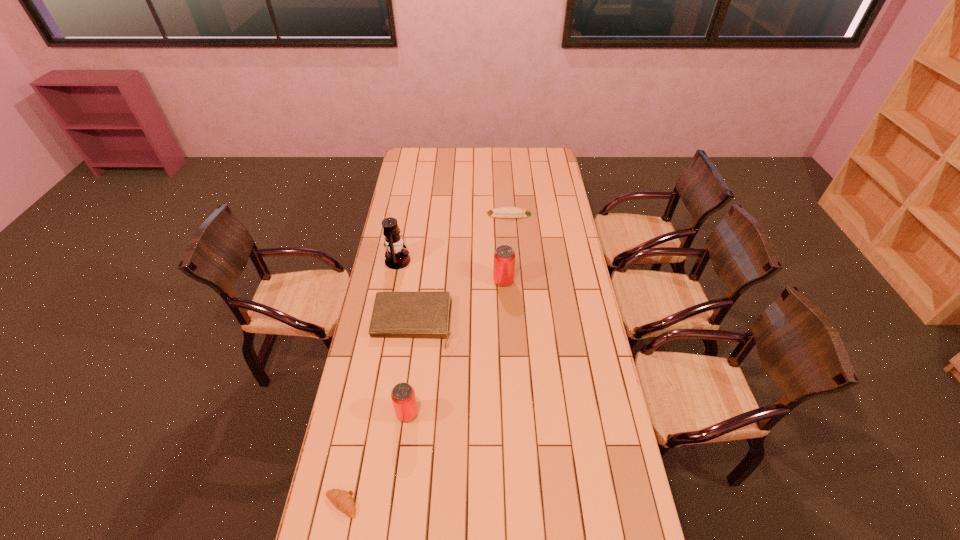
At what (x,y) coordinates should I click in order to perform the action: click on the third tallest object. Please return your answer as a coordinate pair (x, y). The height and width of the screenshot is (540, 960). Looking at the image, I should click on (403, 397).

Find the location of a particular element. The width and height of the screenshot is (960, 540). the shorter can is located at coordinates (403, 397).

Identify the location of the farther can. Image resolution: width=960 pixels, height=540 pixels. (504, 256).

Where is `the right can`? the right can is located at coordinates click(x=504, y=256).

You are a GUI agent. You are given a task and a screenshot of the screen. Output one action in this format:
    pyautogui.click(x=<x>, y=<y>)
    Task: Click on the farthest object
    This screenshot has height=540, width=960.
    Given the screenshot: What is the action you would take?
    pyautogui.click(x=503, y=212)

This screenshot has height=540, width=960. Identify the location of the fourth tallest object. tap(395, 314).

Identify the location of paperback book. (395, 314).

Identify the location of lantern. Image resolution: width=960 pixels, height=540 pixels. (396, 258).

Find the location of `the tallest object`. the tallest object is located at coordinates coord(396,258).

Where is `crescent roll`? This screenshot has width=960, height=540. crescent roll is located at coordinates (342, 500).